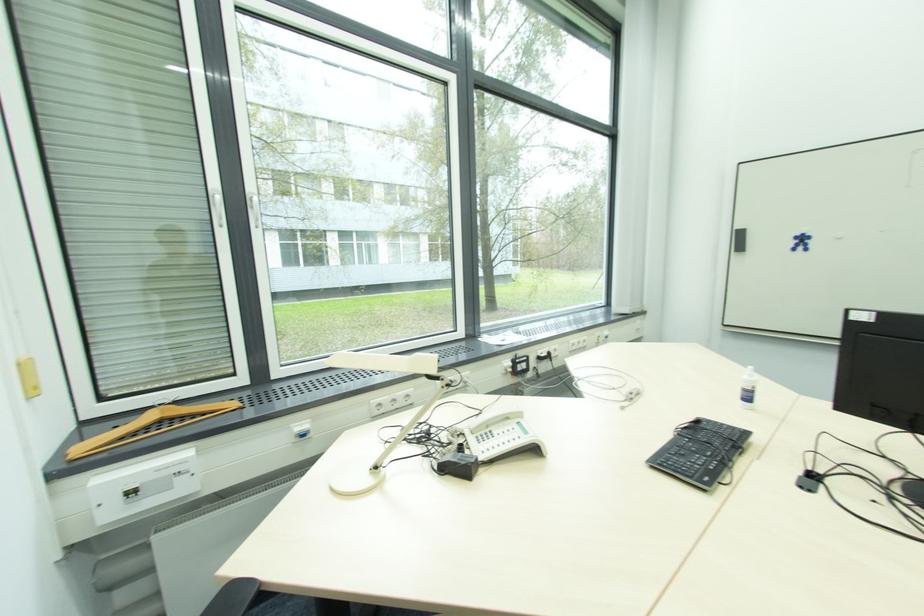
This screenshot has height=616, width=924. In order to click on black whiteboard eraser in this screenshot , I will do `click(738, 240)`.